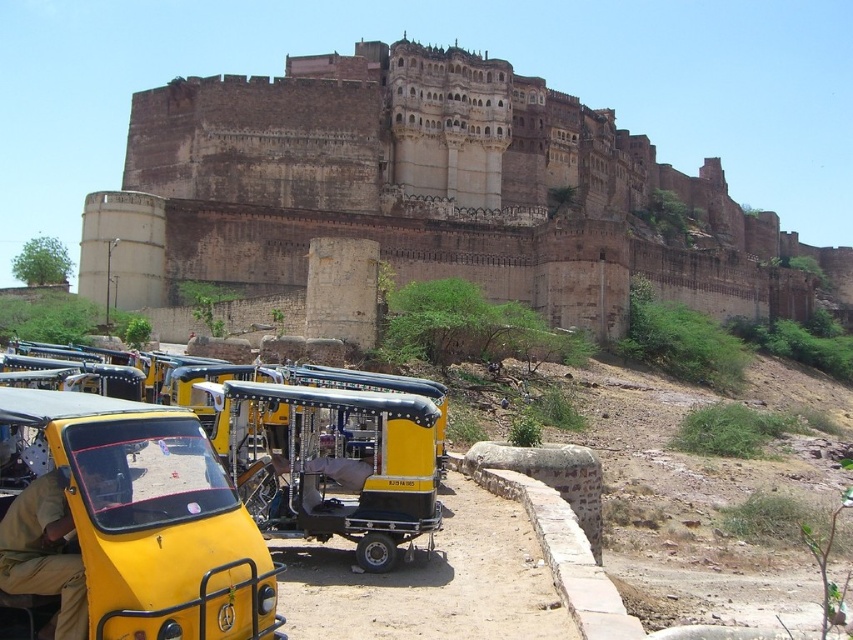
You are a tourist standing at the foot of the brown stone castle at upper center and notice a khaki fabric shirt at lower left. Which object is taller?

The brown stone castle at upper center is taller than the khaki fabric shirt at lower left.

You are standing at the foot of the historic fortification and want to reach the point marked at coordinates point [48,586]. If your walking speed is 3 feet per second, how many seconds will it take you to reach that point?

The distance between you and point [48,586] is 110.98 feet. At a walking speed of 3 feet per second, it will take approximately 37 seconds to reach the point.